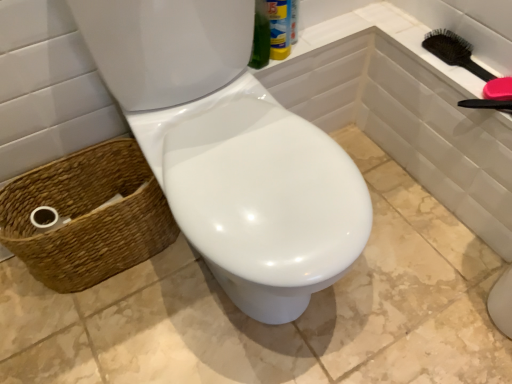
Question: From the image's perspective, would you say woven brown basket at lower left is shown under white glossy toilet at center?

Choices:
 (A) no
 (B) yes

Answer: (B)

Question: From the image's perspective, is woven brown basket at lower left on white glossy toilet at center?

Choices:
 (A) no
 (B) yes

Answer: (A)

Question: Would you say white glossy toilet at center is part of woven brown basket at lower left's contents?

Choices:
 (A) yes
 (B) no

Answer: (B)

Question: From a real-world perspective, is woven brown basket at lower left beneath white glossy toilet at center?

Choices:
 (A) no
 (B) yes

Answer: (B)

Question: Are woven brown basket at lower left and white glossy toilet at center beside each other?

Choices:
 (A) yes
 (B) no

Answer: (B)

Question: Is black plastic hairbrush at upper right taller or shorter than white glossy toilet at center?

Choices:
 (A) tall
 (B) short

Answer: (B)

Question: Do you think black plastic hairbrush at upper right is within white glossy toilet at center, or outside of it?

Choices:
 (A) inside
 (B) outside

Answer: (B)

Question: Based on their sizes in the image, would you say black plastic hairbrush at upper right is bigger or smaller than white glossy toilet at center?

Choices:
 (A) big
 (B) small

Answer: (B)

Question: From a real-world perspective, is black plastic hairbrush at upper right physically located above or below white glossy toilet at center?

Choices:
 (A) above
 (B) below

Answer: (A)

Question: Considering the positions of woven brown basket at lower left and white glossy toilet at center in the image, is woven brown basket at lower left wider or thinner than white glossy toilet at center?

Choices:
 (A) thin
 (B) wide

Answer: (B)

Question: Does point (118, 230) appear closer or farther from the camera than point (240, 215)?

Choices:
 (A) closer
 (B) farther

Answer: (B)

Question: Relative to white glossy toilet at center, is woven brown basket at lower left in front or behind?

Choices:
 (A) front
 (B) behind

Answer: (B)

Question: From a real-world perspective, is woven brown basket at lower left physically located above or below white glossy toilet at center?

Choices:
 (A) above
 (B) below

Answer: (B)

Question: Is white glossy toilet at center taller or shorter than black plastic hairbrush at upper right?

Choices:
 (A) short
 (B) tall

Answer: (B)

Question: Considering the positions of white glossy toilet at center and black plastic hairbrush at upper right in the image, is white glossy toilet at center bigger or smaller than black plastic hairbrush at upper right?

Choices:
 (A) small
 (B) big

Answer: (B)